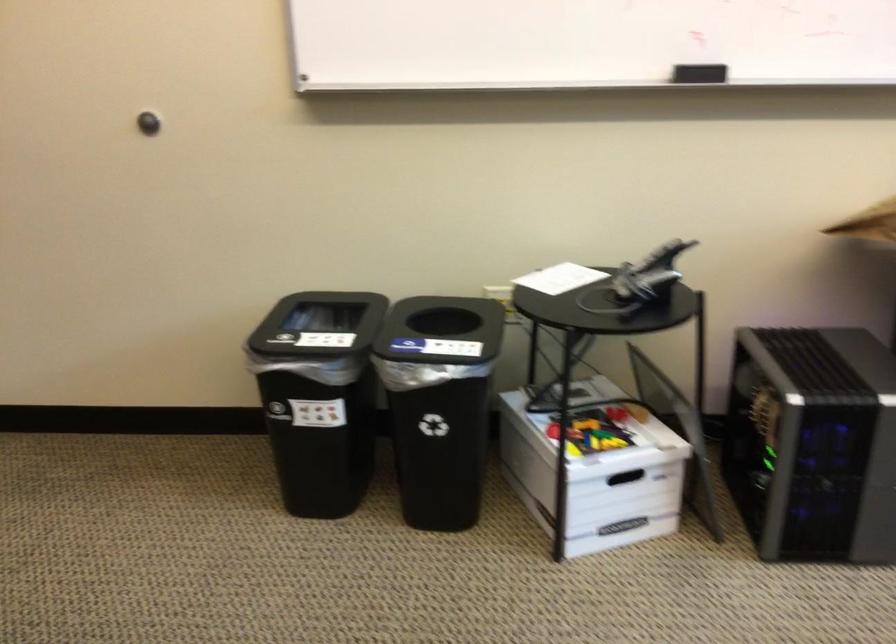
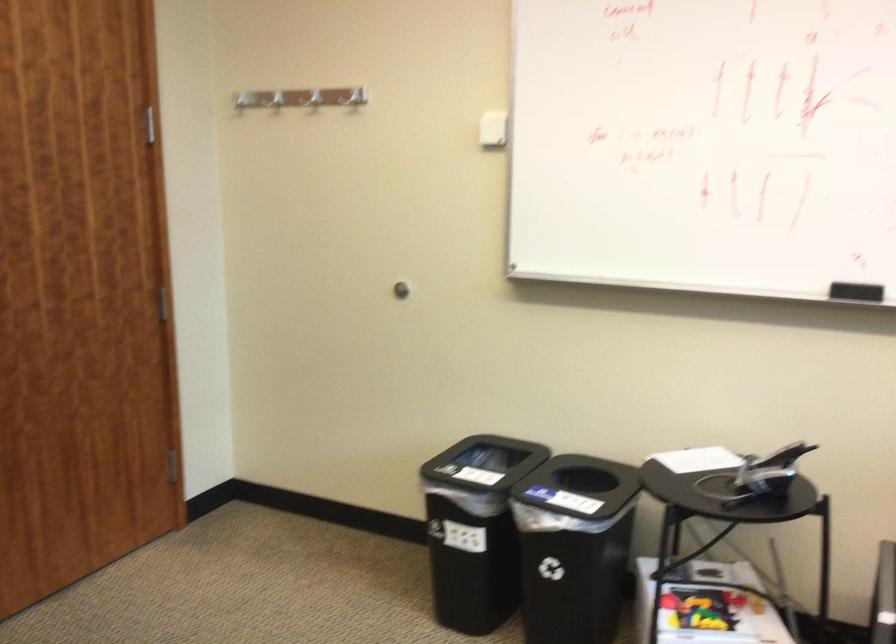
The point at (330, 402) is marked in the first image. Where is the corresponding point in the second image?

(475, 529)